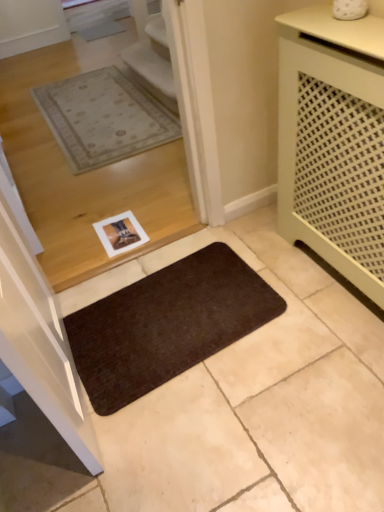
Locate an element on the screen. This screenshot has width=384, height=512. free spot to the right of brown matte mat at lower center is located at coordinates (299, 307).